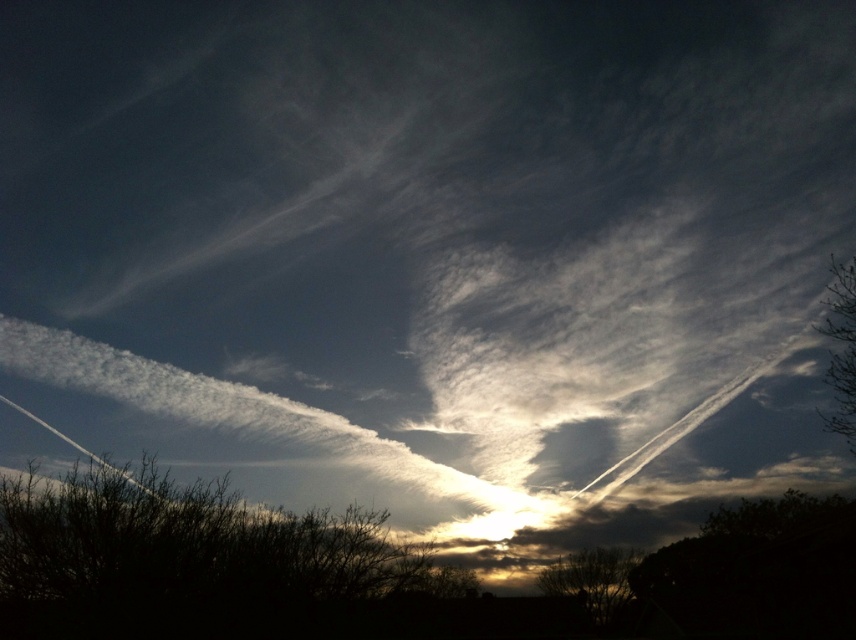
Question: Among these points, which one is nearest to the camera?

Choices:
 (A) (596, 595)
 (B) (813, 324)
 (C) (9, 602)

Answer: (C)

Question: Can you confirm if silhouette bare tree at lower center is smaller than green leafy tree at upper right?

Choices:
 (A) no
 (B) yes

Answer: (B)

Question: Does silhouette bare tree at lower center lie behind green leafy tree at upper right?

Choices:
 (A) yes
 (B) no

Answer: (A)

Question: Among these objects, which one is farthest from the camera?

Choices:
 (A) green leafy tree at upper right
 (B) silhouette bare tree at lower center

Answer: (B)

Question: Does silhouette leafless tree at lower center appear on the left side of green leafy tree at upper right?

Choices:
 (A) no
 (B) yes

Answer: (B)

Question: Which point is closer to the camera?

Choices:
 (A) silhouette leafless tree at lower center
 (B) silhouette bare tree at lower center
 (C) green leafy tree at upper right

Answer: (A)